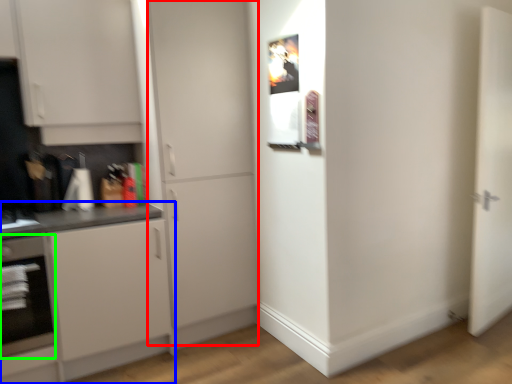
Question: Estimate the real-world distances between objects in this image. Which object is closer to door (highlighted by a red box), cabinetry (highlighted by a blue box) or oven (highlighted by a green box)?

Choices:
 (A) cabinetry
 (B) oven

Answer: (A)